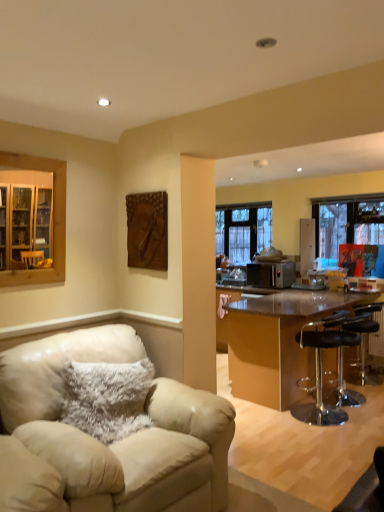
The height and width of the screenshot is (512, 384). In order to click on free spot above wooden cabinet at left (from a real-world perspective) in this screenshot , I will do `click(33, 154)`.